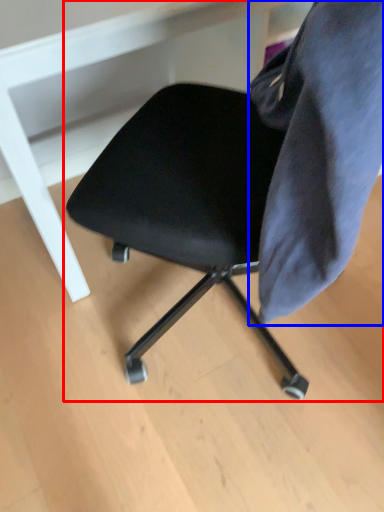
Question: Which object appears farthest to the camera in this image, chair (highlighted by a red box) or fabric (highlighted by a blue box)?

Choices:
 (A) chair
 (B) fabric

Answer: (B)